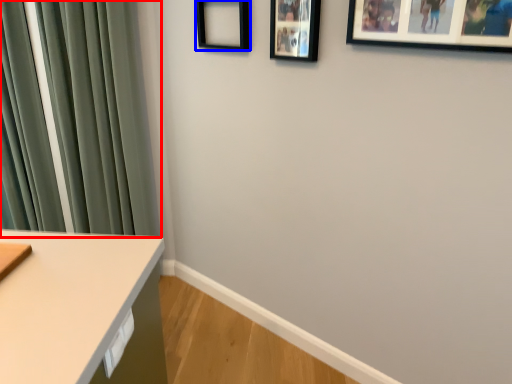
Question: Which object is closer to the camera taking this photo, curtain (highlighted by a red box) or picture frame (highlighted by a blue box)?

Choices:
 (A) curtain
 (B) picture frame

Answer: (B)